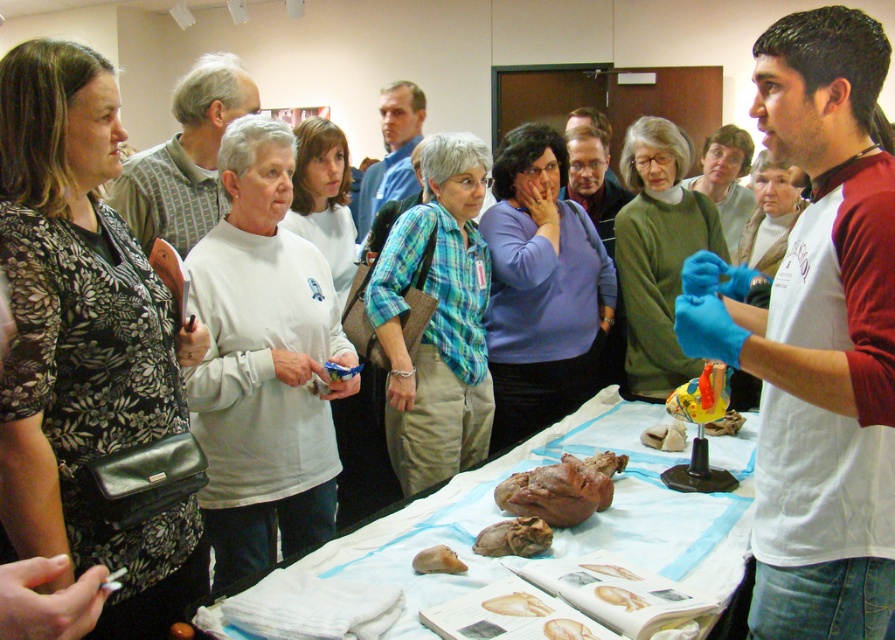
You are a student in the class and need to compare the sizes of the yellowish matte bone at center and the brown matte bread at center on the table. Which one is bigger?

The brown matte bread at center is bigger than the yellowish matte bone at center.

You are a student in the class and need to compare the heights of the yellowish matte bone at center and the brown matte bread at center on the table. Which one is taller?

The brown matte bread at center is taller than the yellowish matte bone at center.